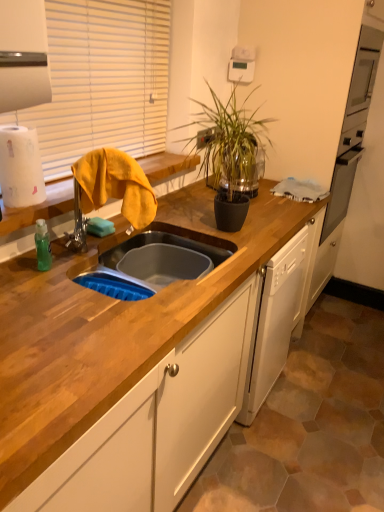
Question: Is wooden countertop at center taller or shorter than white matte paper towel at left?

Choices:
 (A) short
 (B) tall

Answer: (B)

Question: Is wooden countertop at center in front of or behind white matte paper towel at left in the image?

Choices:
 (A) behind
 (B) front

Answer: (B)

Question: Which object is positioned closest to the wooden countertop at center?

Choices:
 (A) green glossy plant at center
 (B) yellow fabric at left
 (C) wooden at left
 (D) white matte paper towel at left
 (E) yellow fabric at left

Answer: (E)

Question: Considering the real-world distances, which object is closest to the yellow fabric at left?

Choices:
 (A) green glossy plant at center
 (B) yellow fabric at left
 (C) wooden countertop at center
 (D) white matte paper towel at left
 (E) wooden at left

Answer: (D)